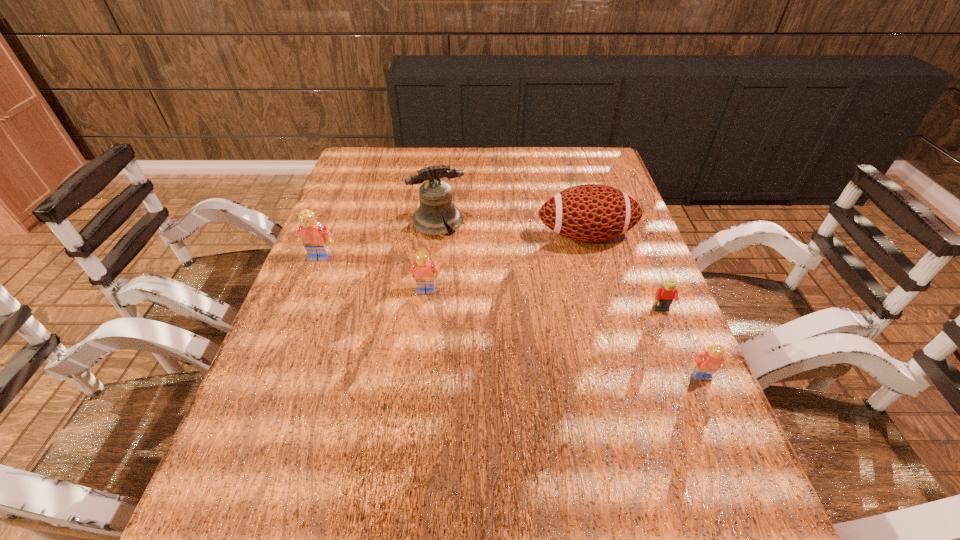
This screenshot has width=960, height=540. Find the location of `vacant space that is in between the nearest object and the tallest object`. vacant space that is in between the nearest object and the tallest object is located at coordinates (570, 300).

This screenshot has height=540, width=960. In order to click on free area in between the third farthest Lego and the nearest object in this screenshot , I will do `click(682, 343)`.

Locate an element on the screen. vacant area that lies between the football and the third shortest Lego is located at coordinates (506, 263).

Point out which object is positioned as the second nearest to the nearest Lego. Please provide its 2D coordinates. Your answer should be formatted as a tuple, i.e. [(x, y)], where the tuple contains the x and y coordinates of a point satisfying the conditions above.

[(591, 212)]

You are a GUI agent. You are given a task and a screenshot of the screen. Output one action in this format:
    pyautogui.click(x=<x>, y=<y>)
    Task: Click on the object that is the third closest one to the football
    The height and width of the screenshot is (540, 960).
    Given the screenshot: What is the action you would take?
    pyautogui.click(x=424, y=270)

Image resolution: width=960 pixels, height=540 pixels. I want to click on the third closest Lego to the leftmost Lego, so click(x=705, y=364).

What are the coordinates of `Lego that can be found as the fourth closest to the football` in the screenshot? It's located at 315,238.